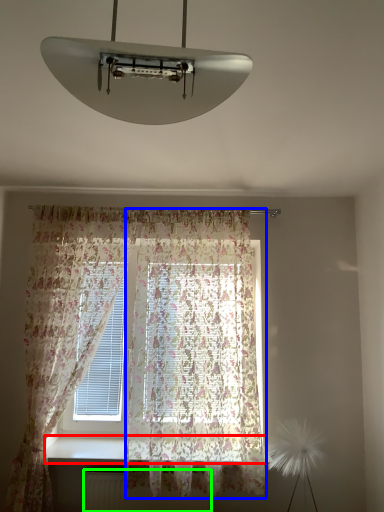
Question: Which is farther away from window sill (highlighted by a red box)? curtain (highlighted by a blue box) or radiator (highlighted by a green box)?

Choices:
 (A) curtain
 (B) radiator

Answer: (A)